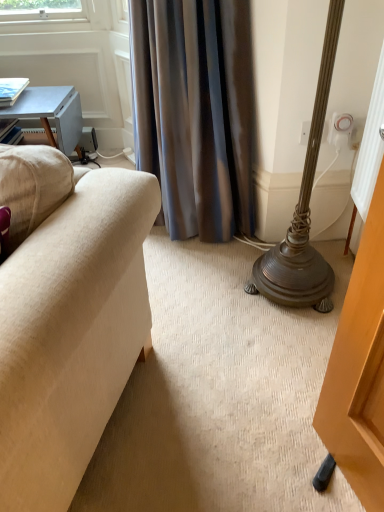
Question: Does point (349, 116) appear closer or farther from the camera than point (62, 131)?

Choices:
 (A) closer
 (B) farther

Answer: (A)

Question: Considering the positions of white plastic electric outlet at upper right and light blue wooden table at upper left in the image, is white plastic electric outlet at upper right taller or shorter than light blue wooden table at upper left?

Choices:
 (A) tall
 (B) short

Answer: (B)

Question: Considering the real-world distances, which object is closest to the silky gray curtain at center?

Choices:
 (A) light blue wooden table at upper left
 (B) white plastic electric outlet at upper right

Answer: (B)

Question: Which of these objects is positioned farthest from the silky gray curtain at center?

Choices:
 (A) light blue wooden table at upper left
 (B) white plastic electric outlet at upper right

Answer: (A)